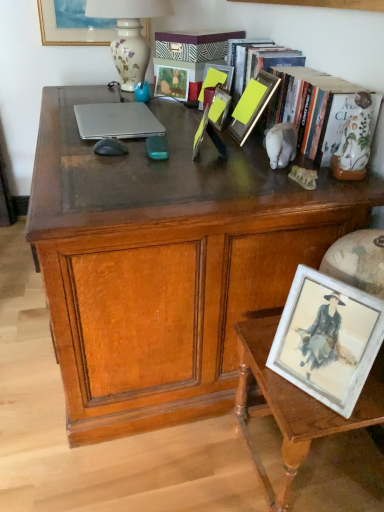
Locate an element on the screen. The height and width of the screenshot is (512, 384). vacant space to the right of transparent plastic mobile phone at center is located at coordinates (204, 155).